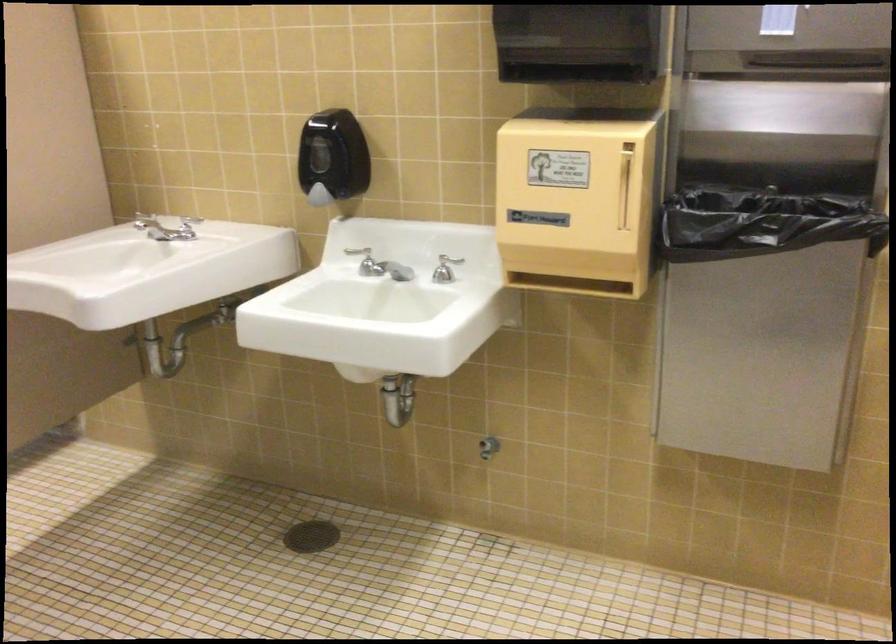
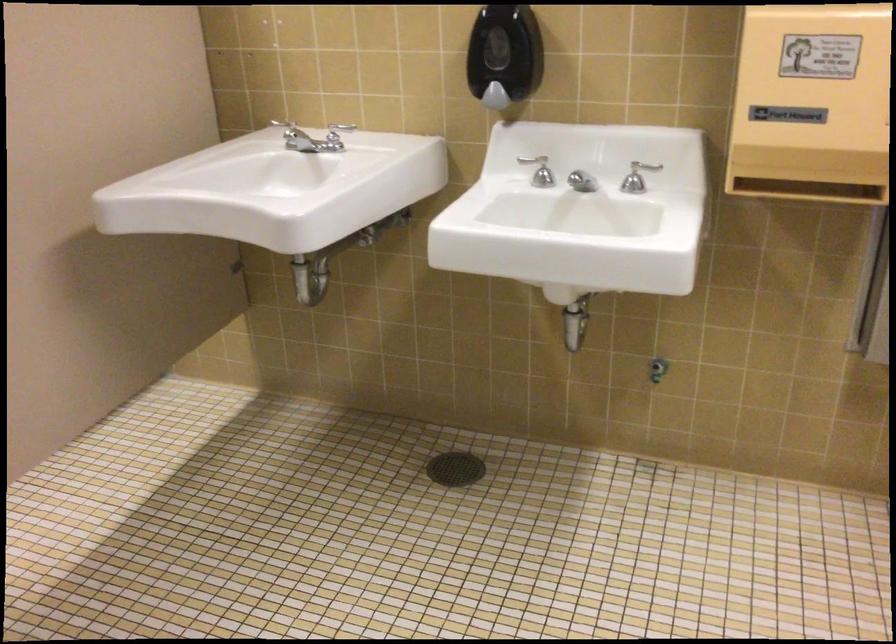
Question: What movement of the cameraman would produce the second image?

Choices:
 (A) Left
 (B) Right
 (C) Forward
 (D) Backward

Answer: (A)